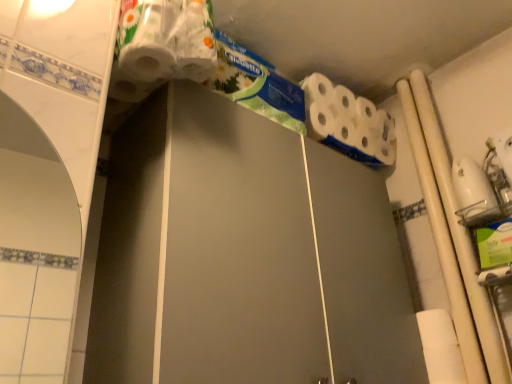
The height and width of the screenshot is (384, 512). Identify the location of white matte toilet paper at upper right. (348, 122).

This screenshot has width=512, height=384. Describe the element at coordinates (348, 122) in the screenshot. I see `white matte toilet paper at upper right` at that location.

Where is `green floral toothpaste at upper center`? This screenshot has width=512, height=384. green floral toothpaste at upper center is located at coordinates (257, 85).

Describe the element at coordinates (257, 85) in the screenshot. This screenshot has width=512, height=384. I see `green floral toothpaste at upper center` at that location.

This screenshot has height=384, width=512. I want to click on white matte toilet paper at upper right, so click(348, 122).

Between white matte toilet paper at upper right and green floral toothpaste at upper center, which one appears on the left side from the viewer's perspective?

Positioned to the left is green floral toothpaste at upper center.

Which object is further away from the camera taking this photo, white matte toilet paper at upper right or green floral toothpaste at upper center?

white matte toilet paper at upper right is further away from the camera.

Is point (329, 131) positioned before point (274, 118)?

No, it is behind (274, 118).

From the image's perspective, is white matte toilet paper at upper right below green floral toothpaste at upper center?

Yes, from the image's perspective, white matte toilet paper at upper right is beneath green floral toothpaste at upper center.

From a real-world perspective, does white matte toilet paper at upper right stand above green floral toothpaste at upper center?

Yes, from a real-world perspective, white matte toilet paper at upper right is over green floral toothpaste at upper center

Considering the sizes of objects white matte toilet paper at upper right and green floral toothpaste at upper center in the image provided, who is thinner, white matte toilet paper at upper right or green floral toothpaste at upper center?

green floral toothpaste at upper center is thinner.

Is white matte toilet paper at upper right taller than green floral toothpaste at upper center?

Correct, white matte toilet paper at upper right is much taller as green floral toothpaste at upper center.

Looking at the image, does white matte toilet paper at upper right seem bigger or smaller compared to green floral toothpaste at upper center?

In the image, white matte toilet paper at upper right appears to be larger than green floral toothpaste at upper center.

Could green floral toothpaste at upper center be considered to be inside white matte toilet paper at upper right?

No, green floral toothpaste at upper center is not a part of white matte toilet paper at upper right.

In the scene shown: Is white matte toilet paper at upper right next to green floral toothpaste at upper center and touching it?

No, white matte toilet paper at upper right is not in contact with green floral toothpaste at upper center.

Is white matte toilet paper at upper right positioned with its back to green floral toothpaste at upper center?

No, white matte toilet paper at upper right's orientation is not away from green floral toothpaste at upper center.

How much distance is there between white matte toilet paper at upper right and green floral toothpaste at upper center?

9.14 inches.

In order to click on toothpaste located in front of the white matte toilet paper at upper right in this screenshot , I will do `click(257, 85)`.

Between green floral toothpaste at upper center and white matte toilet paper at upper right, which one appears on the left side from the viewer's perspective?

green floral toothpaste at upper center is more to the left.

Looking at this image, between green floral toothpaste at upper center and white matte toilet paper at upper right, which one is positioned behind?

white matte toilet paper at upper right is more distant.

Which is further, (218,75) or (395,153)?

The point (395,153) is behind.

From the image's perspective, which object appears higher, green floral toothpaste at upper center or white matte toilet paper at upper right?

green floral toothpaste at upper center is shown above in the image.

From a real-world perspective, does green floral toothpaste at upper center sit lower than white matte toilet paper at upper right?

Yes.

From the picture: Considering the sizes of objects green floral toothpaste at upper center and white matte toilet paper at upper right in the image provided, who is thinner, green floral toothpaste at upper center or white matte toilet paper at upper right?

With smaller width is green floral toothpaste at upper center.

Which of these two, green floral toothpaste at upper center or white matte toilet paper at upper right, stands shorter?

green floral toothpaste at upper center.

Considering the relative sizes of green floral toothpaste at upper center and white matte toilet paper at upper right in the image provided, is green floral toothpaste at upper center smaller than white matte toilet paper at upper right?

Indeed, green floral toothpaste at upper center has a smaller size compared to white matte toilet paper at upper right.

Is green floral toothpaste at upper center spatially inside white matte toilet paper at upper right, or outside of it?

green floral toothpaste at upper center is not enclosed by white matte toilet paper at upper right.

Is green floral toothpaste at upper center next to white matte toilet paper at upper right?

No, green floral toothpaste at upper center is not beside white matte toilet paper at upper right.

Is green floral toothpaste at upper center oriented away from white matte toilet paper at upper right?

No, green floral toothpaste at upper center is not facing away from white matte toilet paper at upper right.

How different are the orientations of green floral toothpaste at upper center and white matte toilet paper at upper right in degrees?

The facing directions of green floral toothpaste at upper center and white matte toilet paper at upper right are 8.33 degrees apart.

The width and height of the screenshot is (512, 384). I want to click on toilet paper located behind the green floral toothpaste at upper center, so click(348, 122).

In order to click on toilet paper on the right of green floral toothpaste at upper center in this screenshot , I will do `click(348, 122)`.

The height and width of the screenshot is (384, 512). In the image, there is a green floral toothpaste at upper center. What are the coordinates of `toilet paper below it (from the image's perspective)` in the screenshot? It's located at (348, 122).